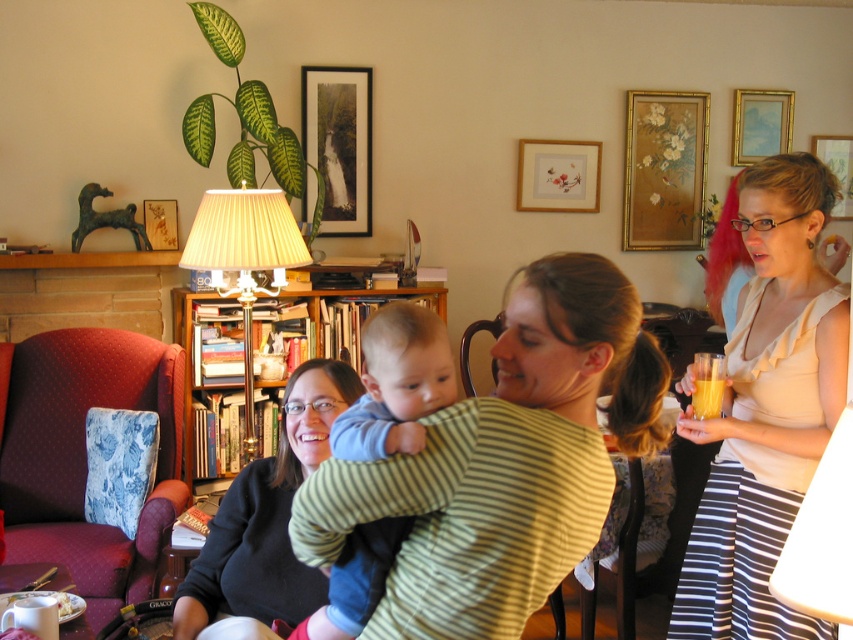
Question: Is wooden bookshelf at center below gold metallic picture frame at upper right?

Choices:
 (A) no
 (B) yes

Answer: (B)

Question: Among these points, which one is farthest from the camera?

Choices:
 (A) (764, 148)
 (B) (404, 385)
 (C) (625, 522)

Answer: (A)

Question: Which point appears closest to the camera in this image?

Choices:
 (A) (465, 346)
 (B) (509, 378)
 (C) (236, 476)
 (D) (113, 556)

Answer: (B)

Question: Does velvet maroon armchair at left have a larger size compared to blue cotton onesie at center?

Choices:
 (A) no
 (B) yes

Answer: (B)

Question: Where is beige sleeveless top at right located in relation to black sweater at center in the image?

Choices:
 (A) left
 (B) right

Answer: (B)

Question: Which point is farther to the camera?

Choices:
 (A) (740, 310)
 (B) (279, 460)
 (C) (589, 163)

Answer: (C)